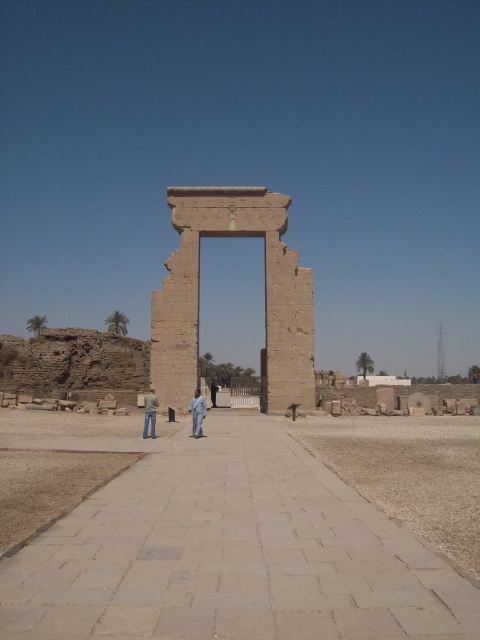
Is point (236, 204) positioned behind point (193, 424)?

Yes, it is.

Looking at this image, who is more distant from viewer, (243, 196) or (196, 392)?

Positioned behind is point (243, 196).

The image size is (480, 640). Describe the element at coordinates (264, 292) in the screenshot. I see `beige stone archway at center` at that location.

Find the location of `beige stone archway at center`. beige stone archway at center is located at coordinates (264, 292).

Is beige stone archway at center to the left of jeans at center from the viewer's perspective?

In fact, beige stone archway at center is to the right of jeans at center.

Is beige stone archway at center below jeans at center?

No.

This screenshot has height=640, width=480. What do you see at coordinates (264, 292) in the screenshot?
I see `beige stone archway at center` at bounding box center [264, 292].

This screenshot has width=480, height=640. I want to click on beige stone archway at center, so click(x=264, y=292).

Looking at this image, is light brown fabric at center wider than jeans at center?

No.

Does point (196, 428) come in front of point (147, 406)?

Yes, it is.

In order to click on light brown fabric at center in this screenshot , I will do pyautogui.click(x=196, y=413).

I want to click on light brown fabric at center, so click(196, 413).